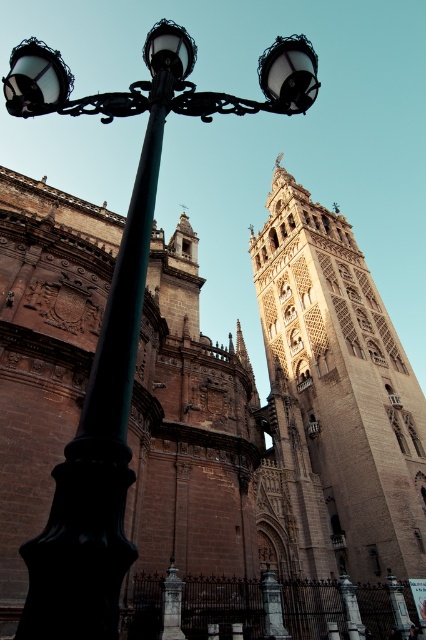
Question: Which point is closer to the camera?

Choices:
 (A) matte black streetlamp at upper left
 (B) black wrought iron street light at left
 (C) light brown stone tower at upper right
 (D) black metal pole at left

Answer: (D)

Question: Can you confirm if light brown stone tower at upper right is positioned to the right of matte black streetlamp at upper left?

Choices:
 (A) yes
 (B) no

Answer: (A)

Question: Is light brown stone tower at upper right wider than black metal pole at left?

Choices:
 (A) no
 (B) yes

Answer: (B)

Question: Observing the image, what is the correct spatial positioning of black wrought iron street light at left in reference to black metal pole at left?

Choices:
 (A) left
 (B) right

Answer: (B)

Question: Which point appears closest to the camera in this image?

Choices:
 (A) (92, 628)
 (B) (308, 81)
 (C) (178, 45)
 (D) (305, 276)

Answer: (A)

Question: Which object is farther from the camera taking this photo?

Choices:
 (A) black wrought iron street light at left
 (B) matte black streetlamp at upper left
 (C) light brown stone tower at upper right

Answer: (C)